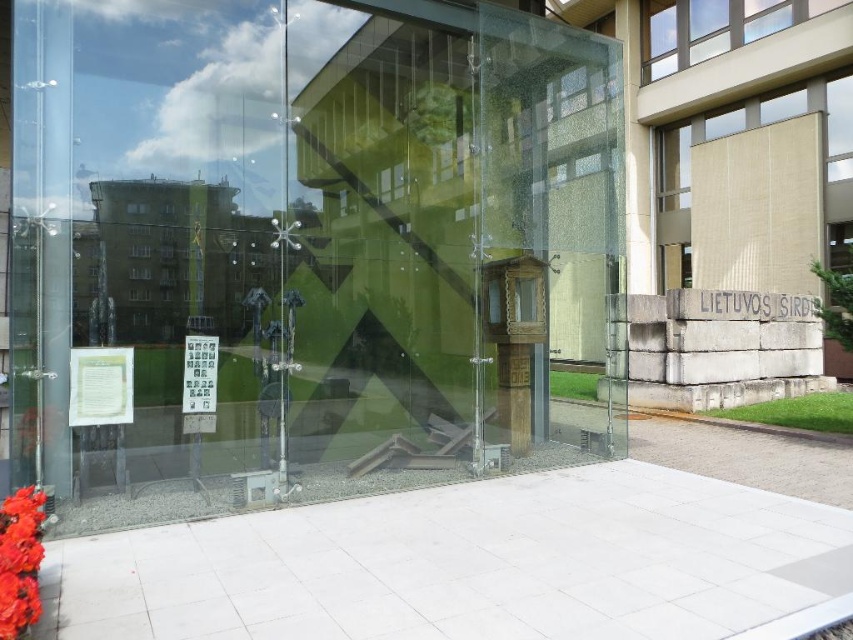
You are standing in front of the glass box structure and want to determine the spatial relationship between the two points marked in the scene. Which point is closer to you, point (x=221, y=237) or point (x=36, y=502)?

Point (x=36, y=502) is closer to you because it is in front of point (x=221, y=237), which is behind it.

You are a landscape architect designing a garden around the transparent glass box at center and the vivid red petals at lower left. Considering their sizes, which object should you place closer to the entrance to ensure visitors can easily notice both elements?

The transparent glass box at center is taller than the vivid red petals at lower left, so to ensure both elements are easily noticed, the vivid red petals at lower left should be placed closer to the entrance since they are smaller and might be overlooked from a distance.

You are a drone operator trying to capture a photo of the transparent glass box at center and the vivid red petals at lower left. From your current position, which object should you adjust your camera to focus on first if you want to ensure both are in frame without moving the drone?

The transparent glass box at center is positioned on the left side of the vivid red petals at lower left, so you should focus on the transparent glass box at center first to ensure both are in frame without moving the drone.